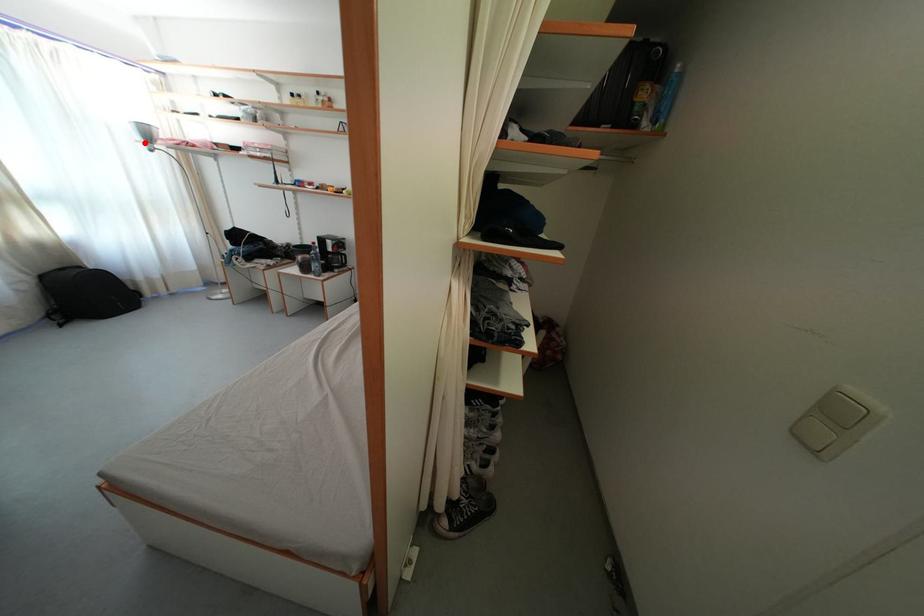
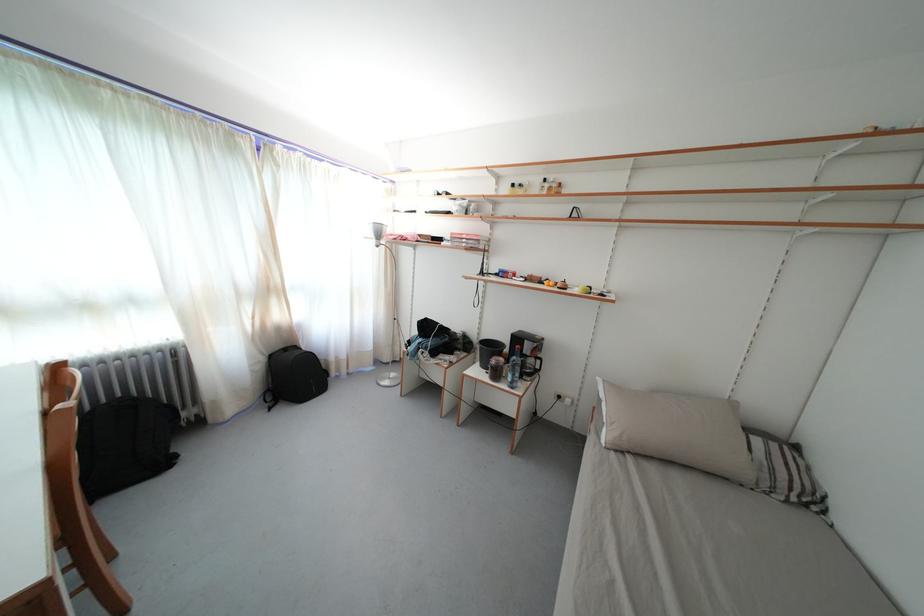
Question: I am providing you with two images of the same scene from different viewpoints. A red point is marked on the first image. Is the red point's position out of view in image 2?

Choices:
 (A) Yes
 (B) No

Answer: (B)